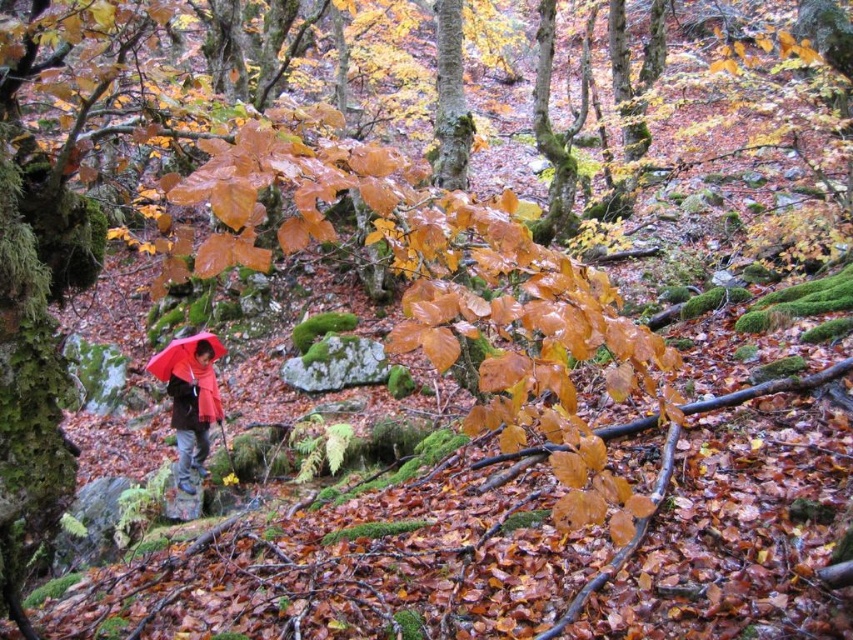
Does red matte jacket at center appear over matte red umbrella at center?

Incorrect, red matte jacket at center is not positioned above matte red umbrella at center.

Who is lower down, red matte jacket at center or matte red umbrella at center?

red matte jacket at center is below.

Measure the distance between red matte jacket at center and camera.

red matte jacket at center is 7.48 meters from camera.

Locate an element on the screen. The image size is (853, 640). red matte jacket at center is located at coordinates (192, 403).